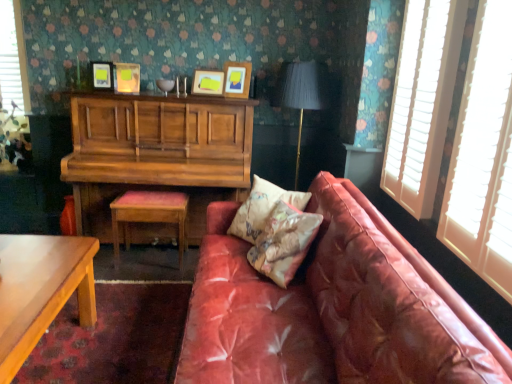
Identify the location of vacant area that lies in front of matte yellow picture frame at upper center, the first picture frame from the left. Image resolution: width=512 pixels, height=384 pixels. (97, 99).